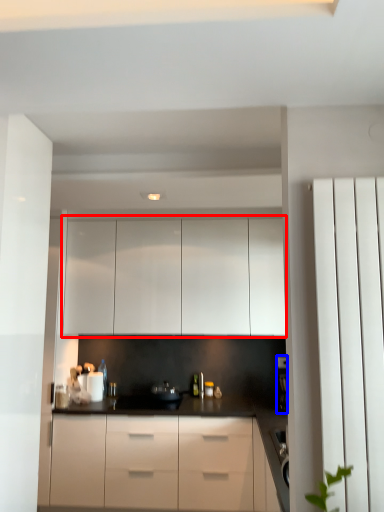
Question: Which point is further to the camera, cabinetry (highlighted by a red box) or coffee machine (highlighted by a blue box)?

Choices:
 (A) cabinetry
 (B) coffee machine

Answer: (A)